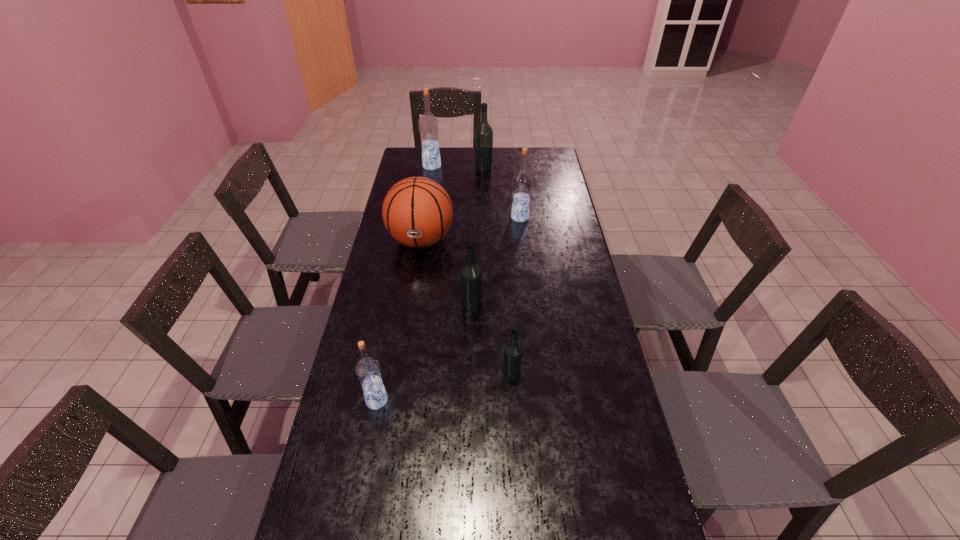
Image resolution: width=960 pixels, height=540 pixels. In order to click on the rightmost black vodka in this screenshot , I will do `click(512, 358)`.

What are the coordinates of `the shortest object` in the screenshot? It's located at (512, 358).

The height and width of the screenshot is (540, 960). What are the coordinates of `free point located 0.320m on the right of the biggest blue vodka` in the screenshot? It's located at (510, 166).

Where is `vacant space located 0.190m on the front of the biggest black vodka`? vacant space located 0.190m on the front of the biggest black vodka is located at coordinates (484, 194).

Identify the location of free spot located 0.210m on the back of the rightmost vodka. (516, 185).

The image size is (960, 540). I want to click on vacant space situated 0.360m on the side where the inflation valve is located, so click(405, 341).

At what (x,y) coordinates should I click in order to perform the action: click on free space located 0.060m on the back of the third nearest object. Please return your answer as a coordinate pair (x, y). The width and height of the screenshot is (960, 540). Looking at the image, I should click on (472, 285).

Find the location of a particular element. free spot located 0.320m on the back of the nearest blue vodka is located at coordinates (396, 305).

I want to click on free region located 0.240m on the front of the smallest black vodka, so click(517, 468).

This screenshot has height=540, width=960. I want to click on basketball that is at the left edge, so click(x=417, y=212).